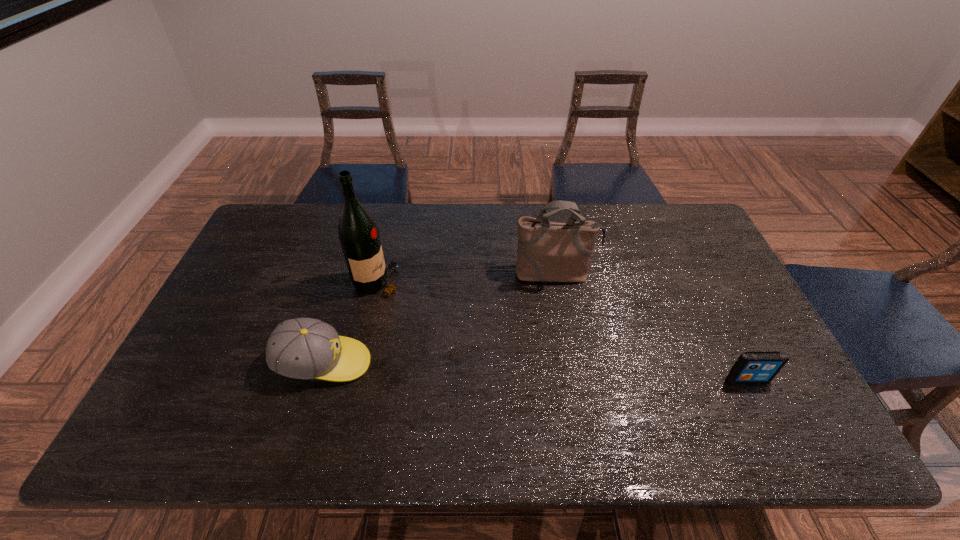
Identify the location of empty location between the baseball cap and the shoulder bag. (440, 319).

Find the location of a particular element. free spot between the shortest object and the tallest object is located at coordinates (563, 330).

Find the location of a particular element. The width and height of the screenshot is (960, 540). free space between the rightmost object and the tallest object is located at coordinates (563, 330).

Where is `vacant area between the wine bottle and the second object from right to left`? This screenshot has width=960, height=540. vacant area between the wine bottle and the second object from right to left is located at coordinates (467, 278).

Where is `vacant area that lies between the rightmost object and the wine bottle`? vacant area that lies between the rightmost object and the wine bottle is located at coordinates (563, 330).

I want to click on free space between the second shortest object and the tallest object, so click(x=351, y=322).

Locate which object is the third closest to the wine bottle. Please provide its 2D coordinates. Your answer should be formatted as a tuple, i.e. [(x, y)], where the tuple contains the x and y coordinates of a point satisfying the conditions above.

[(752, 366)]

This screenshot has width=960, height=540. Identify the location of object that stands as the closest to the third tallest object. (358, 233).

Image resolution: width=960 pixels, height=540 pixels. I want to click on vacant space that satisfies the following two spatial constraints: 1. on the front-facing side of the third shortest object; 2. on the surface of the tallest object, so click(557, 281).

Where is `vacant space that satisfies the following two spatial constraints: 1. on the front-facing side of the shoulder bag; 2. on the surface of the wine bottle`? This screenshot has width=960, height=540. vacant space that satisfies the following two spatial constraints: 1. on the front-facing side of the shoulder bag; 2. on the surface of the wine bottle is located at coordinates (557, 281).